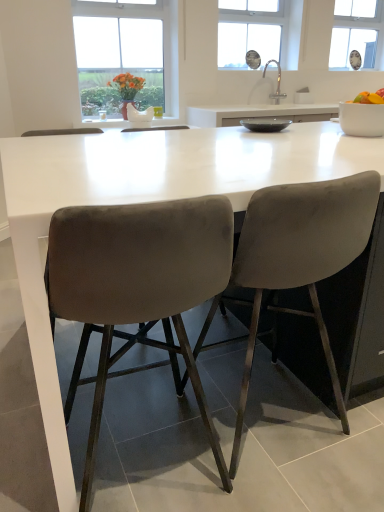
Question: Is white matte bowl at upper right, the 2th bowl viewed from the left, positioned with its back to white ceramic sink at upper center?

Choices:
 (A) no
 (B) yes

Answer: (A)

Question: Considering the relative sizes of white matte bowl at upper right, the 2th bowl viewed from the left, and white ceramic sink at upper center in the image provided, is white matte bowl at upper right, the 2th bowl viewed from the left, thinner than white ceramic sink at upper center?

Choices:
 (A) yes
 (B) no

Answer: (B)

Question: From the image's perspective, is white matte bowl at upper right, the 2th bowl viewed from the left, on white ceramic sink at upper center?

Choices:
 (A) no
 (B) yes

Answer: (A)

Question: Would you consider white matte bowl at upper right, which appears as the 1th bowl when viewed from the right, to be distant from white ceramic sink at upper center?

Choices:
 (A) yes
 (B) no

Answer: (A)

Question: Can you see white matte bowl at upper right, which appears as the 1th bowl when viewed from the right, touching white ceramic sink at upper center?

Choices:
 (A) yes
 (B) no

Answer: (B)

Question: Is white matte bowl at upper right, which appears as the 1th bowl when viewed from the right, spatially inside transparent plastic window screen at upper right, or outside of it?

Choices:
 (A) outside
 (B) inside

Answer: (A)

Question: Would you say white matte bowl at upper right, the 2th bowl viewed from the left, is to the left or to the right of transparent plastic window screen at upper right in the picture?

Choices:
 (A) right
 (B) left

Answer: (B)

Question: From a real-world perspective, is white matte bowl at upper right, which appears as the 1th bowl when viewed from the right, above or below transparent plastic window screen at upper right?

Choices:
 (A) above
 (B) below

Answer: (B)

Question: Is point (347, 125) positioned closer to the camera than point (374, 52)?

Choices:
 (A) closer
 (B) farther

Answer: (A)

Question: From the image's perspective, is yellow matte fruit bowl at right located above or below white ceramic sink at upper center?

Choices:
 (A) below
 (B) above

Answer: (A)

Question: In terms of width, does yellow matte fruit bowl at right look wider or thinner when compared to white ceramic sink at upper center?

Choices:
 (A) thin
 (B) wide

Answer: (A)

Question: Considering their positions, is yellow matte fruit bowl at right located in front of or behind white ceramic sink at upper center?

Choices:
 (A) behind
 (B) front

Answer: (B)

Question: Is yellow matte fruit bowl at right to the left or to the right of white ceramic sink at upper center in the image?

Choices:
 (A) left
 (B) right

Answer: (B)

Question: From a real-world perspective, relative to velvet grey chair at center, the 1th chair positioned from the right, is yellow matte fruit bowl at right vertically above or below?

Choices:
 (A) below
 (B) above

Answer: (B)

Question: In terms of size, does yellow matte fruit bowl at right appear bigger or smaller than velvet grey chair at center, the 1th chair positioned from the right?

Choices:
 (A) big
 (B) small

Answer: (B)